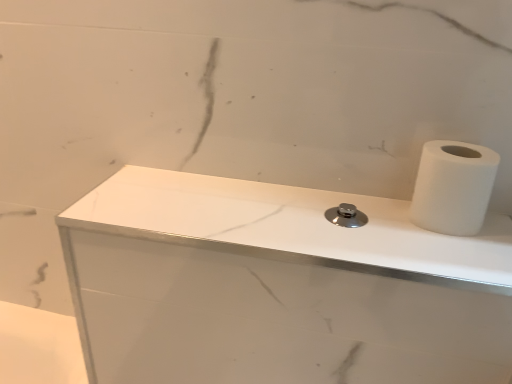
Question: Considering the positions of point (245, 205) and point (450, 216), is point (245, 205) closer or farther from the camera than point (450, 216)?

Choices:
 (A) closer
 (B) farther

Answer: (B)

Question: Visually, is white marble counter top at center positioned to the left or to the right of white matte paper towel at right?

Choices:
 (A) right
 (B) left

Answer: (B)

Question: From a real-world perspective, relative to white matte paper towel at right, is white marble counter top at center vertically above or below?

Choices:
 (A) above
 (B) below

Answer: (B)

Question: From the image's perspective, is white matte paper towel at right located above or below white marble counter top at center?

Choices:
 (A) below
 (B) above

Answer: (B)

Question: Looking at the image, does white matte paper towel at right seem bigger or smaller compared to white marble counter top at center?

Choices:
 (A) small
 (B) big

Answer: (A)

Question: In the image, is white matte paper towel at right positioned in front of or behind white marble counter top at center?

Choices:
 (A) behind
 (B) front

Answer: (A)

Question: Is white matte paper towel at right taller or shorter than white marble counter top at center?

Choices:
 (A) tall
 (B) short

Answer: (B)